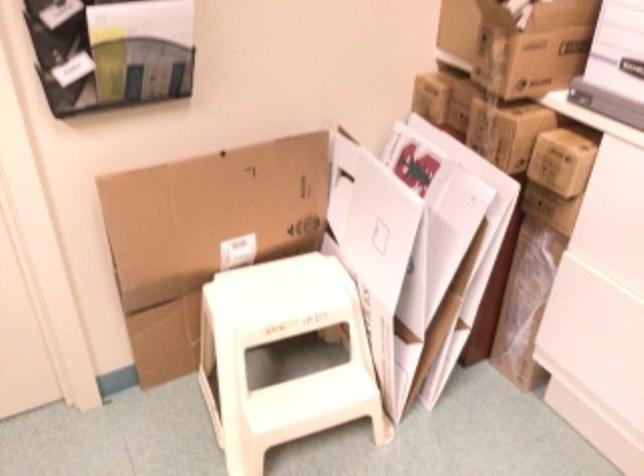
The width and height of the screenshot is (644, 476). In order to click on step stool hand-hold in this screenshot , I will do `click(210, 404)`.